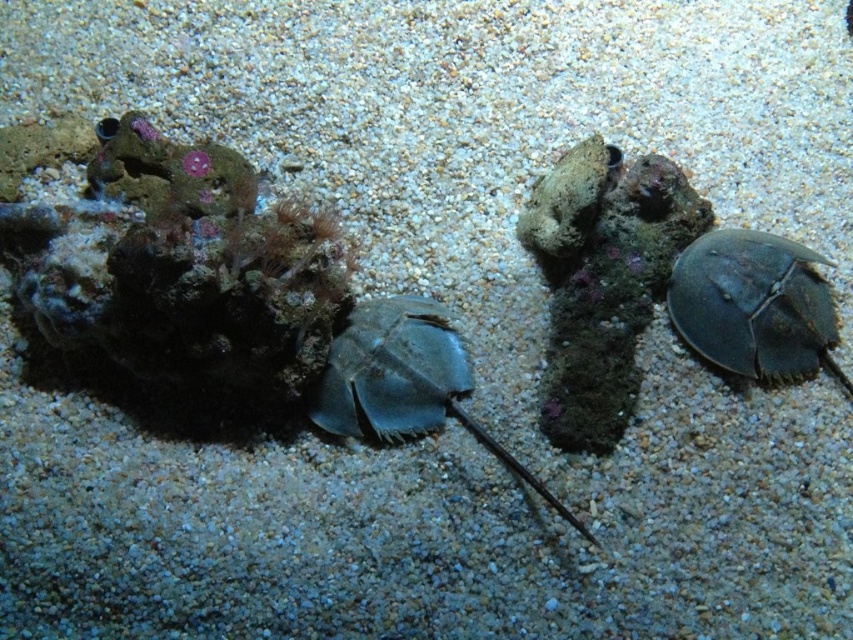
Question: Is smooth gray horseshoe crab at right smaller than satin blue horseshoe crab at center?

Choices:
 (A) no
 (B) yes

Answer: (B)

Question: Which of these objects is positioned farthest from the smooth stone at center?

Choices:
 (A) satin blue horseshoe crab at center
 (B) smooth gray horseshoe crab at right

Answer: (A)

Question: Can you confirm if smooth gray horseshoe crab at right is thinner than smooth stone at center?

Choices:
 (A) no
 (B) yes

Answer: (A)

Question: Among these objects, which one is nearest to the camera?

Choices:
 (A) smooth stone at center
 (B) smooth gray horseshoe crab at right

Answer: (B)

Question: Can you confirm if satin blue horseshoe crab at center is positioned to the left of smooth stone at center?

Choices:
 (A) yes
 (B) no

Answer: (A)

Question: Which point is farther to the camera?

Choices:
 (A) (376, 420)
 (B) (769, 376)

Answer: (B)